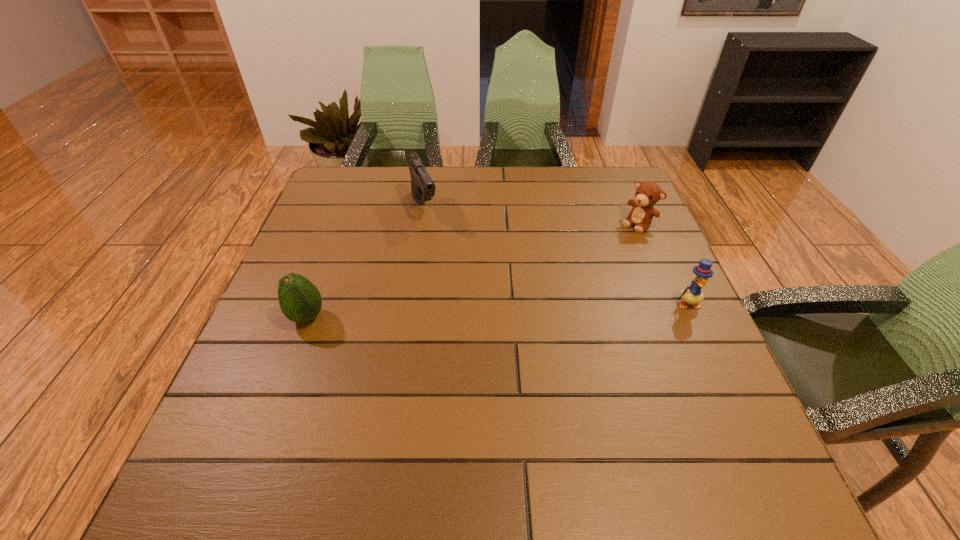
Where is `vacant region located 0.210m at the barrel of the third object from right to left`? The image size is (960, 540). vacant region located 0.210m at the barrel of the third object from right to left is located at coordinates (451, 276).

I want to click on vacant region located 0.400m at the barrel of the third object from right to left, so click(x=480, y=334).

The width and height of the screenshot is (960, 540). Find the location of `object that is positioned at the far edge`. object that is positioned at the far edge is located at coordinates (423, 189).

Find the location of a particular element. object located in the left edge section of the desktop is located at coordinates (300, 301).

Locate an element on the screen. Image resolution: width=960 pixels, height=540 pixels. duckling present at the right edge is located at coordinates (693, 294).

Locate an element on the screen. teddy bear at the right edge is located at coordinates (648, 193).

Find the location of a particular element. The width and height of the screenshot is (960, 540). vacant space at the far edge is located at coordinates (396, 184).

This screenshot has width=960, height=540. In order to click on blank space at the left edge of the desktop in this screenshot , I will do `click(314, 213)`.

Find the location of `free space at the right edge of the desktop`. free space at the right edge of the desktop is located at coordinates (692, 323).

Where is `free space at the far left corner of the desktop`? free space at the far left corner of the desktop is located at coordinates [x=372, y=172].